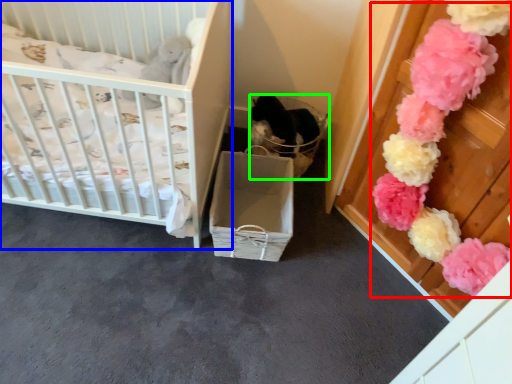
Question: Which object is positioned farthest from flower (highlighted by a red box)? Select from infant bed (highlighted by a blue box) and basket (highlighted by a green box).

Choices:
 (A) infant bed
 (B) basket

Answer: (A)